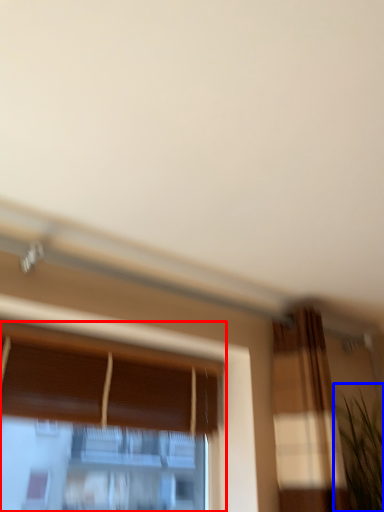
Question: Which object appears closest to the camera in this image, window (highlighted by a red box) or plant (highlighted by a blue box)?

Choices:
 (A) window
 (B) plant

Answer: (A)